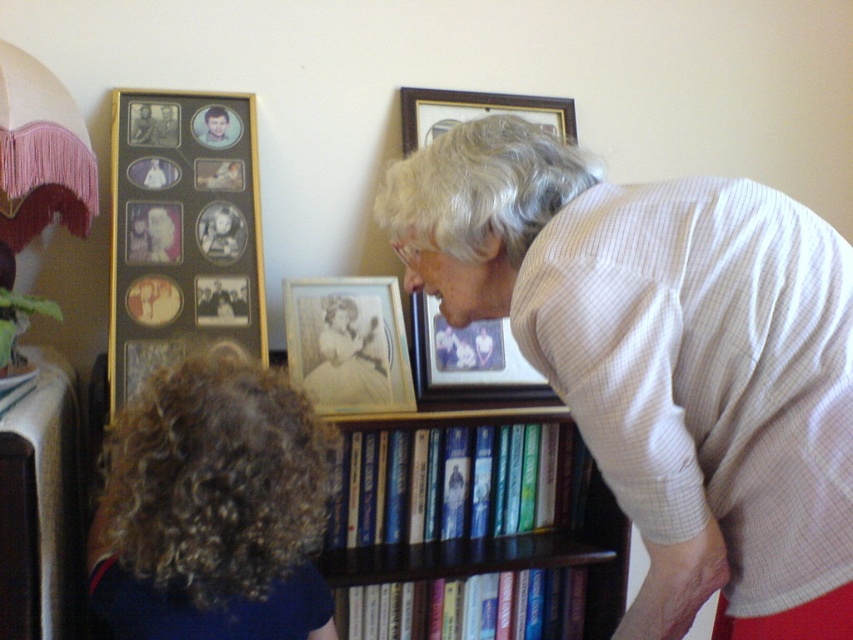
Question: Does dark wood bookshelf at center have a lesser width compared to matte wooden picture frame at center?

Choices:
 (A) no
 (B) yes

Answer: (A)

Question: Where is matte wooden picture frame at center located in relation to gold-framed picture at upper center in the image?

Choices:
 (A) above
 (B) below

Answer: (B)

Question: Which point is farther to the camera?

Choices:
 (A) hardcover books at center
 (B) dark wood bookshelf at center
 (C) gold-framed photo at center

Answer: (A)

Question: Which point is farther to the camera?

Choices:
 (A) hardcover books at center
 (B) light beige sweater at center

Answer: (A)

Question: Can you confirm if curly brown hair at lower left is positioned to the left of hardcover book at center?

Choices:
 (A) yes
 (B) no

Answer: (A)

Question: Which object appears closest to the camera in this image?

Choices:
 (A) gold-framed photo at center
 (B) curly brown hair at lower left
 (C) hardcover books at center
 (D) gold-framed picture at upper center

Answer: (B)